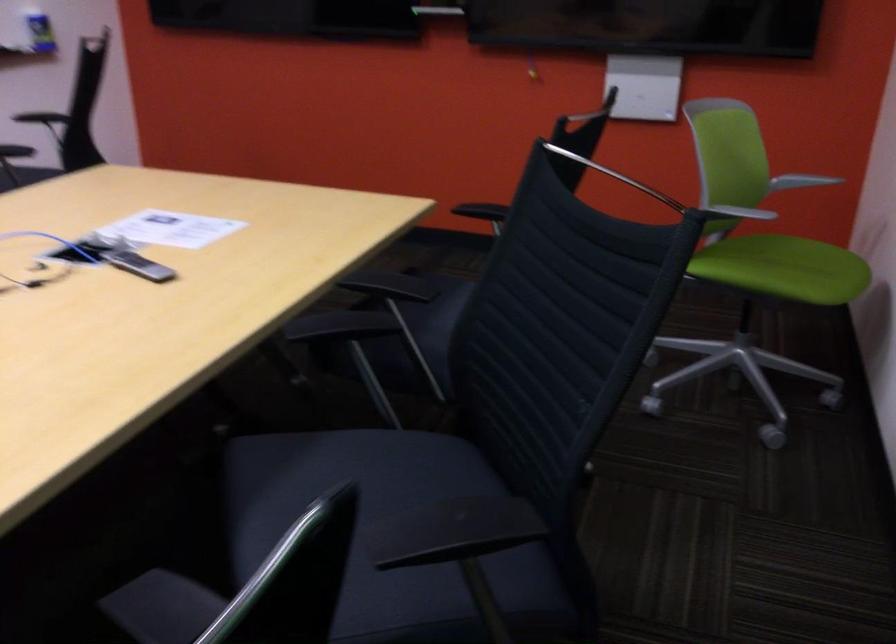
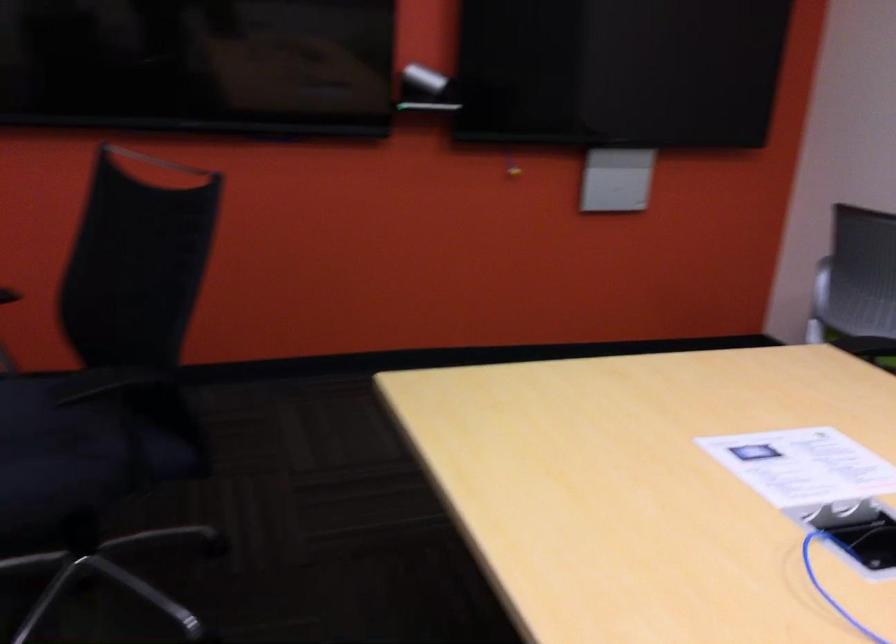
Find the pixel in the second image that matches the point at 199,232 in the first image.

(803, 466)